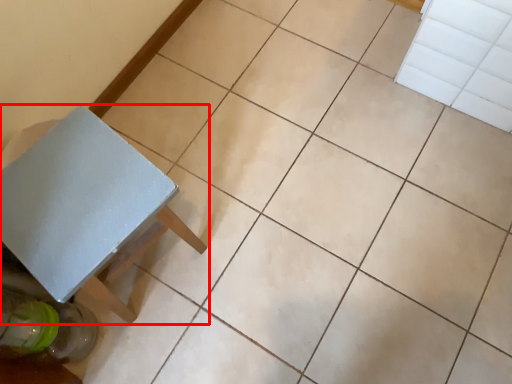
Question: From the image's perspective, where is table (annotated by the red box) located in relation to glass bottle in the image?

Choices:
 (A) above
 (B) below

Answer: (A)